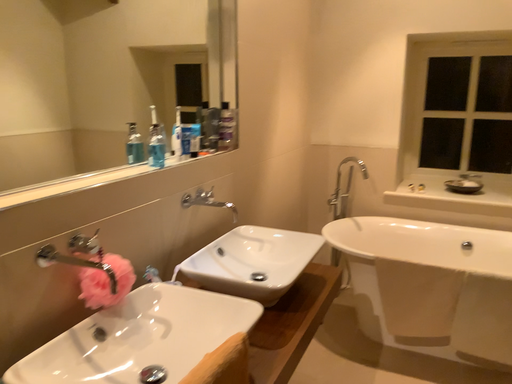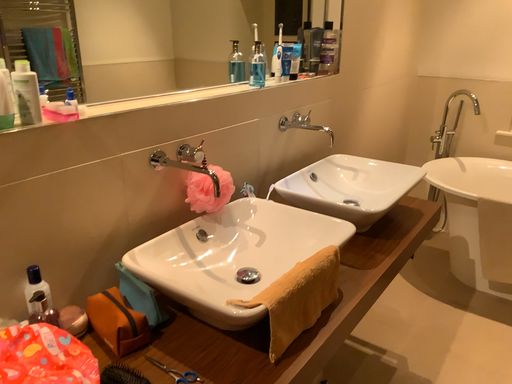
Question: Which way did the camera rotate in the video?

Choices:
 (A) rotated downward
 (B) rotated upward

Answer: (A)